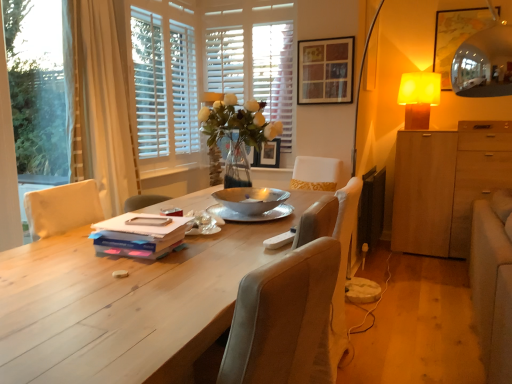
I want to click on yellow fabric lampshade at upper right, so click(x=419, y=97).

The image size is (512, 384). What do you see at coordinates (268, 154) in the screenshot?
I see `wooden picture frame at upper center, acting as the first picture frame starting from the bottom` at bounding box center [268, 154].

This screenshot has height=384, width=512. In order to click on white wood window frame at upper center in this screenshot , I will do `click(165, 87)`.

This screenshot has width=512, height=384. What do you see at coordinates (274, 74) in the screenshot? I see `white wood blinds at upper center` at bounding box center [274, 74].

Describe the element at coordinates (325, 71) in the screenshot. I see `wooden picture frame at upper center, which ranks as the first picture frame in front-to-back order` at that location.

This screenshot has width=512, height=384. I want to click on velvet beige chair at center, so click(x=282, y=318).

Identify the location of yellow fabric lampshade at upper right. Image resolution: width=512 pixels, height=384 pixels. (419, 97).

Considering the positions of objects yellow fabric lampshade at upper right and beige fabric curtain at left in the image provided, who is more to the right, yellow fabric lampshade at upper right or beige fabric curtain at left?

yellow fabric lampshade at upper right is more to the right.

From a real-world perspective, who is located higher, yellow fabric lampshade at upper right or beige fabric curtain at left?

From a 3D spatial view, yellow fabric lampshade at upper right is above.

How much distance is there between yellow fabric lampshade at upper right and beige fabric curtain at left?

The distance of yellow fabric lampshade at upper right from beige fabric curtain at left is 8.74 feet.

Is beige fabric curtain at left at the back of yellow fabric lampshade at upper right?

yellow fabric lampshade at upper right is not turned away from beige fabric curtain at left.

Considering the positions of points (323, 100) and (33, 46), is point (323, 100) closer to camera compared to point (33, 46)?

No, it is not.

Is wooden picture frame at upper center, which is the second picture frame in left-to-right order, positioned before transparent plastic window screen at left?

That is False.

How different are the orientations of wooden picture frame at upper center, which is the second picture frame in left-to-right order, and transparent plastic window screen at left in degrees?

They differ by 88.7 degrees in their facing directions.

From the picture: Measure the distance between wooden picture frame at upper center, which is counted as the first picture frame, starting from the right, and transparent plastic window screen at left.

wooden picture frame at upper center, which is counted as the first picture frame, starting from the right, is 1.88 meters away from transparent plastic window screen at left.

Does velvet beige chair at center appear on the left side of beige fabric curtain at left?

No, velvet beige chair at center is not to the left of beige fabric curtain at left.

In terms of width, does velvet beige chair at center look wider or thinner when compared to beige fabric curtain at left?

In the image, velvet beige chair at center appears to be wider than beige fabric curtain at left.

Is the position of velvet beige chair at center less distant than that of beige fabric curtain at left?

Yes.

From the image's perspective, is velvet beige chair at center located beneath beige fabric curtain at left?

Indeed, from the image's perspective, velvet beige chair at center is shown beneath beige fabric curtain at left.

Considering the sizes of objects wooden picture frame at upper center, the 2th picture frame positioned from the back, and wooden picture frame at upper center, which appears as the second picture frame when viewed from the front, in the image provided, who is wider, wooden picture frame at upper center, the 2th picture frame positioned from the back, or wooden picture frame at upper center, which appears as the second picture frame when viewed from the front,?

Wider between the two is wooden picture frame at upper center, which appears as the second picture frame when viewed from the front.

How many degrees apart are the facing directions of wooden picture frame at upper center, the 2th picture frame positioned from the back, and wooden picture frame at upper center, acting as the first picture frame starting from the bottom?

The facing directions of wooden picture frame at upper center, the 2th picture frame positioned from the back, and wooden picture frame at upper center, acting as the first picture frame starting from the bottom, are 1.37 degrees apart.

From a real-world perspective, is wooden picture frame at upper center, which is counted as the first picture frame, starting from the right, on wooden picture frame at upper center, arranged as the 1th picture frame when viewed from the left?

Yes, from a real-world perspective, wooden picture frame at upper center, which is counted as the first picture frame, starting from the right, is over wooden picture frame at upper center, arranged as the 1th picture frame when viewed from the left

From the image's perspective, is wooden picture frame at upper center, which is the second picture frame in left-to-right order, below wooden picture frame at upper center, which appears as the second picture frame when viewed from the front?

Incorrect, from the image's perspective, wooden picture frame at upper center, which is the second picture frame in left-to-right order, is higher than wooden picture frame at upper center, which appears as the second picture frame when viewed from the front.

Does light wood table at center have a lesser width compared to white wood window frame at upper center?

Incorrect, the width of light wood table at center is not less than that of white wood window frame at upper center.

Considering the sizes of objects light wood table at center and white wood window frame at upper center in the image provided, who is bigger, light wood table at center or white wood window frame at upper center?

light wood table at center is bigger.

Is the depth of light wood table at center less than that of white wood window frame at upper center?

Yes.

From the image's perspective, is transparent plastic window screen at left over yellow fabric lampshade at upper right?

Actually, transparent plastic window screen at left appears below yellow fabric lampshade at upper right in the image.

Would you say transparent plastic window screen at left is a long distance from yellow fabric lampshade at upper right?

Yes, transparent plastic window screen at left and yellow fabric lampshade at upper right are quite far apart.

How far apart are transparent plastic window screen at left and yellow fabric lampshade at upper right?

transparent plastic window screen at left is 9.91 feet from yellow fabric lampshade at upper right.

Does transparent plastic window screen at left come behind yellow fabric lampshade at upper right?

No.

Is light wood table at center next to beige fabric curtain at left and touching it?

No, light wood table at center is not next to beige fabric curtain at left.

Identify the location of curtain on the left side of light wood table at center. The width and height of the screenshot is (512, 384). (99, 100).

Measure the distance from light wood table at center to beige fabric curtain at left.

light wood table at center is 3.97 feet from beige fabric curtain at left.

Does light wood table at center turn towards beige fabric curtain at left?

No, light wood table at center is not turned towards beige fabric curtain at left.

Where is `table lamp above the beige fabric curtain at left (from the image's perspective)`? The width and height of the screenshot is (512, 384). table lamp above the beige fabric curtain at left (from the image's perspective) is located at coordinates (419, 97).

Identify the location of window screen that is under the wooden picture frame at upper center, the 2th picture frame in the bottom-to-top sequence (from a real-world perspective). This screenshot has height=384, width=512. (37, 89).

Based on their spatial positions, is beige fabric curtain at left or velvet beige chair at center closer to white wood window frame at upper center?

Among the two, beige fabric curtain at left is located nearer to white wood window frame at upper center.

Which object lies further to the anchor point velvet beige chair at center, wooden picture frame at upper center, which is counted as the first picture frame, starting from the right, or beige fabric curtain at left?

wooden picture frame at upper center, which is counted as the first picture frame, starting from the right, lies further to velvet beige chair at center than the other object.

Estimate the real-world distances between objects in this image. Which object is further from light wood table at center, light brown wood cabinet at right or white wood window frame at upper center?

light brown wood cabinet at right lies further to light wood table at center than the other object.

Looking at the image, which one is located further to transparent plastic window screen at left, white wood blinds at upper center or yellow fabric lampshade at upper right?

yellow fabric lampshade at upper right is positioned further to the anchor transparent plastic window screen at left.

Considering their positions, is beige fabric curtain at left positioned further to matte blue book at center than yellow fabric lampshade at upper right?

yellow fabric lampshade at upper right.

Estimate the real-world distances between objects in this image. Which object is further from beige fabric curtain at left, transparent plastic window screen at left or light wood table at center?

light wood table at center is positioned further to the anchor beige fabric curtain at left.

Based on their spatial positions, is light brown wood cabinet at right or transparent plastic window screen at left further from matte blue book at center?

light brown wood cabinet at right is positioned further to the anchor matte blue book at center.

From the picture: Based on their spatial positions, is white wood window frame at upper center or light wood table at center further from wooden picture frame at upper center, which appears as the second picture frame when viewed from the front?

light wood table at center.

What are the coordinates of `curtain located between light wood table at center and wooden picture frame at upper center, which is the second picture frame in top-to-bottom order, in the depth direction` in the screenshot? It's located at (99, 100).

Locate an element on the screen. This screenshot has height=384, width=512. chair located between light wood table at center and white wood blinds at upper center in the depth direction is located at coordinates (282, 318).

This screenshot has height=384, width=512. I want to click on window frame between velvet beige chair at center and wooden picture frame at upper center, which ranks as the first picture frame in front-to-back order, from front to back, so click(165, 87).

Identify the location of curtain between matte blue book at center and white wood window frame at upper center from front to back. (99, 100).